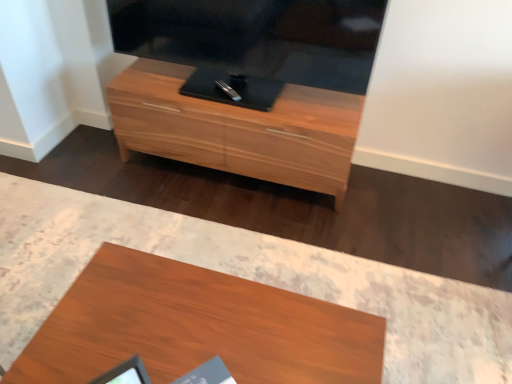
Question: From the image's perspective, is wooden desk at center located above or below wooden chest of drawers at center?

Choices:
 (A) below
 (B) above

Answer: (A)

Question: Considering the positions of point (376, 326) and point (280, 145), is point (376, 326) closer or farther from the camera than point (280, 145)?

Choices:
 (A) closer
 (B) farther

Answer: (A)

Question: Considering the positions of wooden desk at center and wooden chest of drawers at center in the image, is wooden desk at center bigger or smaller than wooden chest of drawers at center?

Choices:
 (A) small
 (B) big

Answer: (A)

Question: Looking at their shapes, would you say wooden chest of drawers at center is wider or thinner than wooden desk at center?

Choices:
 (A) wide
 (B) thin

Answer: (B)

Question: From a real-world perspective, is wooden chest of drawers at center above or below wooden desk at center?

Choices:
 (A) above
 (B) below

Answer: (A)

Question: Based on their positions, is wooden chest of drawers at center located to the left or right of wooden desk at center?

Choices:
 (A) left
 (B) right

Answer: (B)

Question: Would you say wooden chest of drawers at center is inside or outside wooden desk at center?

Choices:
 (A) inside
 (B) outside

Answer: (B)